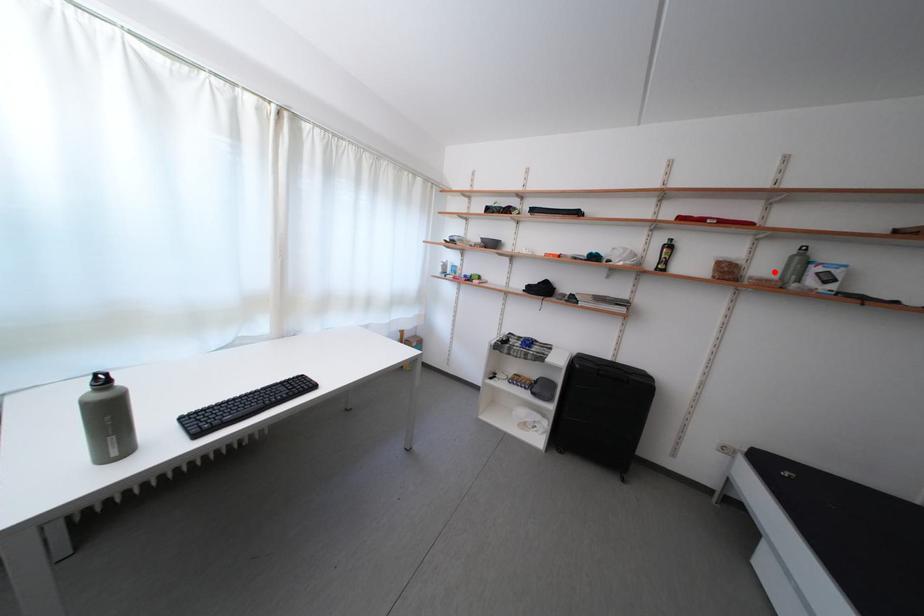
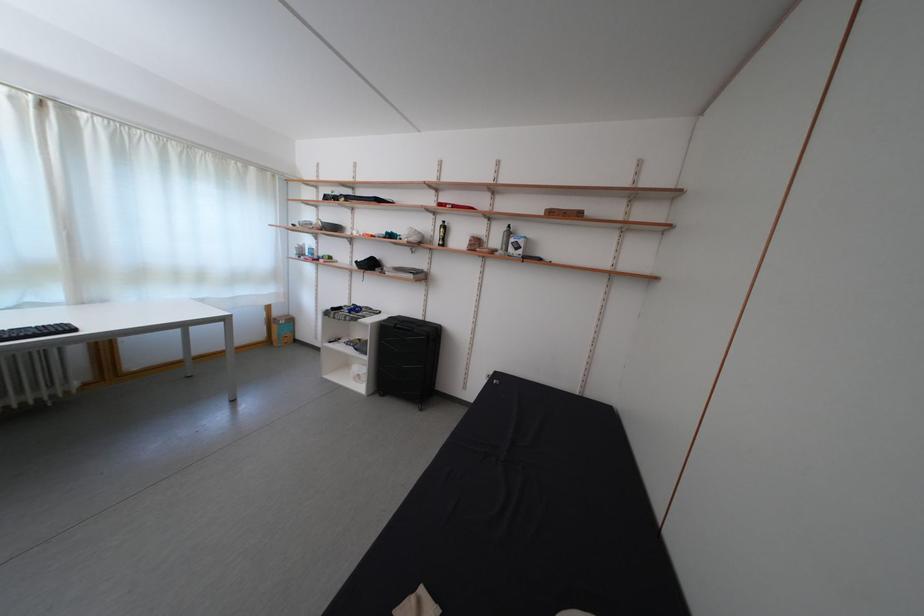
Where in the second image is the point corresponding to the highlighted location from the first image?

(505, 246)